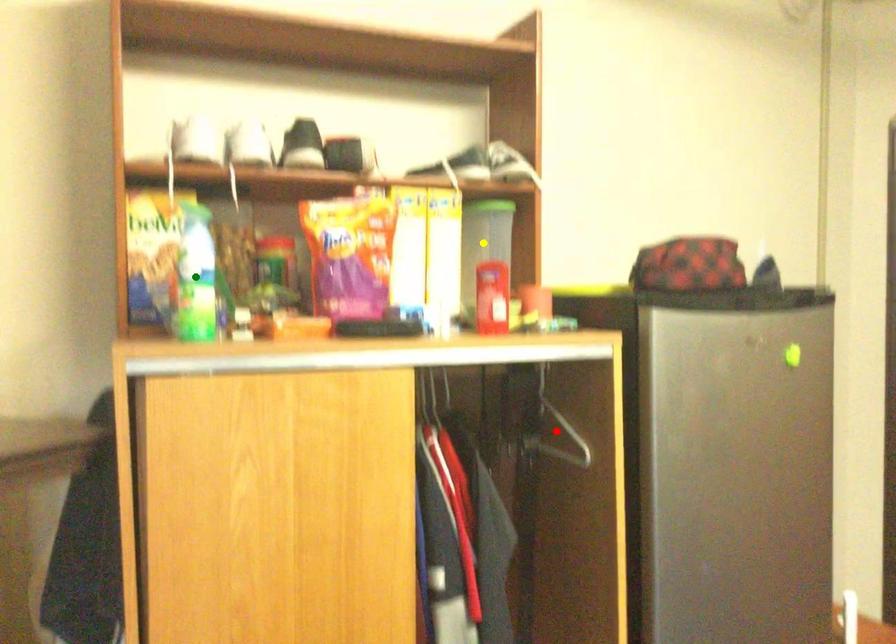
Order these from nearest to farthest:
yellow point | red point | green point

green point → red point → yellow point